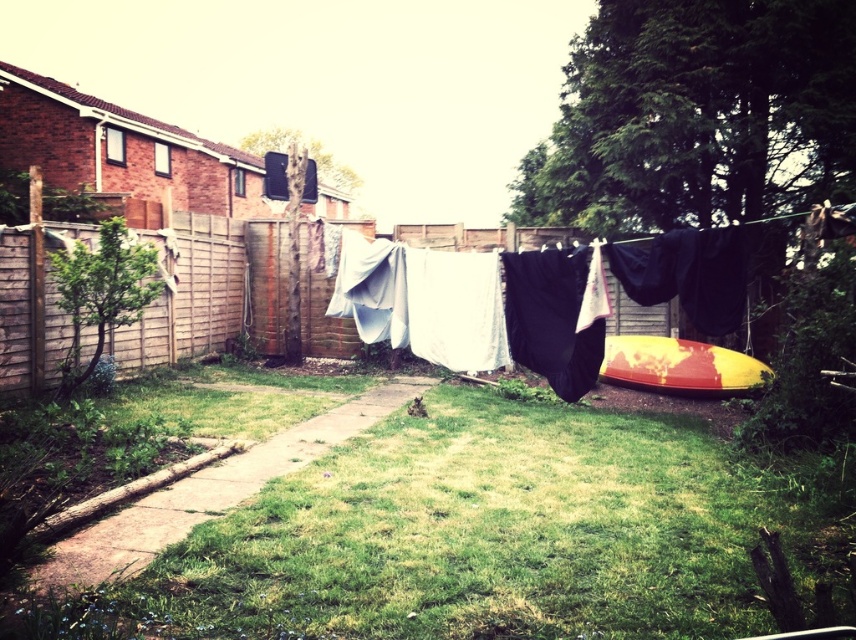
Can you confirm if white fabric at center is smaller than yellow and red painted canoe at right?

Actually, white fabric at center might be larger than yellow and red painted canoe at right.

Describe the element at coordinates (477, 307) in the screenshot. I see `white fabric at center` at that location.

The image size is (856, 640). What are the coordinates of `white fabric at center` in the screenshot? It's located at (477, 307).

Between green grass at center and yellow and red painted canoe at right, which one is positioned higher?

Positioned higher is yellow and red painted canoe at right.

Is green grass at center further to the viewer compared to yellow and red painted canoe at right?

No, green grass at center is in front of yellow and red painted canoe at right.

What do you see at coordinates (461, 538) in the screenshot? I see `green grass at center` at bounding box center [461, 538].

The height and width of the screenshot is (640, 856). Find the location of `green grass at center`. green grass at center is located at coordinates (461, 538).

Is green grass at center closer to the viewer compared to white fabric at center?

Yes, green grass at center is in front of white fabric at center.

Does green grass at center have a greater height compared to white fabric at center?

Incorrect, green grass at center's height is not larger of white fabric at center's.

Does point (697, 556) come behind point (363, 298)?

No, (697, 556) is in front of (363, 298).

You are a GUI agent. You are given a task and a screenshot of the screen. Output one action in this format:
    pyautogui.click(x=<x>, y=<y>)
    Task: Click on the green grass at center
    This screenshot has width=856, height=640.
    Given the screenshot: What is the action you would take?
    pyautogui.click(x=461, y=538)